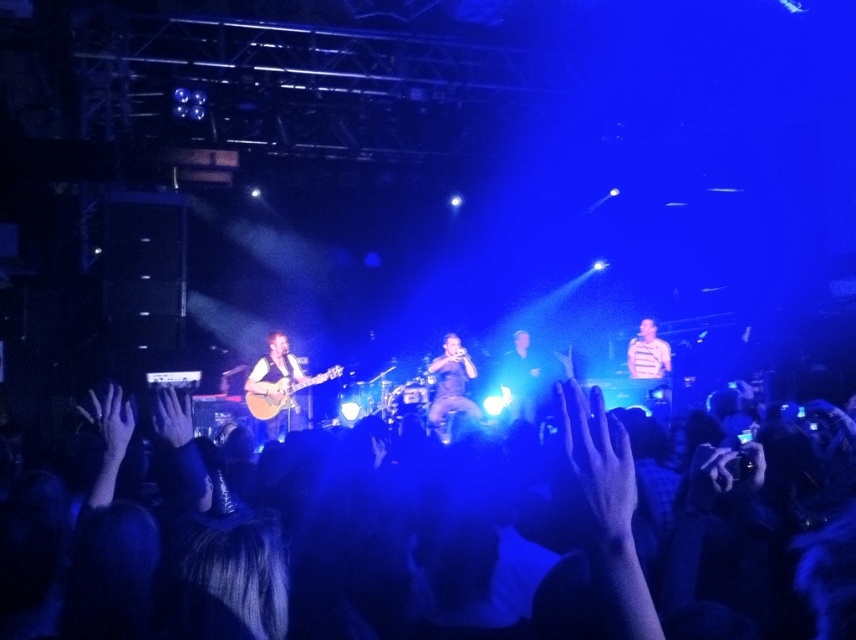
Measure the distance between black fabric hands at lower center and camera.

A distance of 6.13 feet exists between black fabric hands at lower center and camera.

Does black fabric hands at lower center appear over matte brown acoustic guitar at left?

Correct, black fabric hands at lower center is located above matte brown acoustic guitar at left.

Is point (128, 589) positioned in front of point (302, 420)?

Yes, it is.

This screenshot has width=856, height=640. Identify the location of black fabric hands at lower center. (605, 512).

Does acoustic guitar at left have a larger size compared to striped shirt at right?

Yes, acoustic guitar at left is bigger than striped shirt at right.

Who is shorter, acoustic guitar at left or striped shirt at right?

Standing shorter between the two is acoustic guitar at left.

Describe the element at coordinates (281, 392) in the screenshot. The height and width of the screenshot is (640, 856). I see `acoustic guitar at left` at that location.

Find the location of `acoustic guitar at left`. acoustic guitar at left is located at coordinates (281, 392).

Between point (461, 348) and point (260, 406), which one is positioned in front?

Point (260, 406)

Is point (450, 381) farther from camera compared to point (290, 384)?

Yes, point (450, 381) is behind point (290, 384).

Describe the element at coordinates (450, 385) in the screenshot. This screenshot has height=640, width=856. I see `shiny black microphone at center` at that location.

Where is `shiny black microphone at center`? The height and width of the screenshot is (640, 856). shiny black microphone at center is located at coordinates (450, 385).